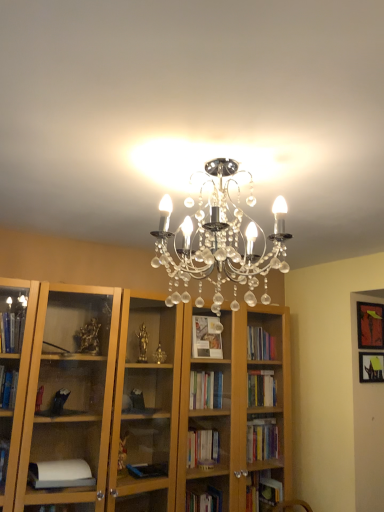
At what (x,y) coordinates should I click in order to perform the action: click on matte black picture frame at upper right, placed as the first picture frame when sorted from top to bottom. Please return your answer as a coordinate pair (x, y). Looking at the image, I should click on (370, 325).

This screenshot has width=384, height=512. What do you see at coordinates (370, 325) in the screenshot?
I see `matte black picture frame at upper right, placed as the 2th picture frame when sorted from bottom to top` at bounding box center [370, 325].

How much space does matte black picture frame at upper right, placed as the first picture frame when sorted from top to bottom, occupy vertically?

matte black picture frame at upper right, placed as the first picture frame when sorted from top to bottom, is 12.43 inches in height.

At what (x,y) coordinates should I click in order to perform the action: click on matte black picture frame at upper right, positioned as the 1th picture frame in bottom-to-top order. Please return your answer as a coordinate pair (x, y). This screenshot has width=384, height=512. Looking at the image, I should click on (371, 367).

This screenshot has width=384, height=512. Describe the element at coordinates (371, 367) in the screenshot. I see `matte black picture frame at upper right, the 2th picture frame from the top` at that location.

In order to face matte black picture frame at upper right, the 2th picture frame from the top, should I rotate leftwards or rightwards?

A 22.996 degree turn to the right will do.

Locate an element on the screen. This screenshot has height=512, width=384. matte black picture frame at upper right, placed as the 2th picture frame when sorted from bottom to top is located at coordinates (370, 325).

Which object is positioned more to the left, matte black picture frame at upper right, placed as the 2th picture frame when sorted from bottom to top, or matte black picture frame at upper right, positioned as the 1th picture frame in bottom-to-top order?

Positioned to the left is matte black picture frame at upper right, positioned as the 1th picture frame in bottom-to-top order.

Which object is further away from the camera taking this photo, matte black picture frame at upper right, placed as the first picture frame when sorted from top to bottom, or matte black picture frame at upper right, positioned as the 1th picture frame in bottom-to-top order?

matte black picture frame at upper right, placed as the first picture frame when sorted from top to bottom, is further from the camera.

Is point (364, 310) closer to camera compared to point (379, 364)?

No, it is behind (379, 364).

From the image's perspective, is matte black picture frame at upper right, placed as the 2th picture frame when sorted from bottom to top, on matte black picture frame at upper right, the 2th picture frame from the top?

Indeed, from the image's perspective, matte black picture frame at upper right, placed as the 2th picture frame when sorted from bottom to top, is shown above matte black picture frame at upper right, the 2th picture frame from the top.

Based on the photo, from a real-world perspective, is matte black picture frame at upper right, placed as the 2th picture frame when sorted from bottom to top, on top of matte black picture frame at upper right, positioned as the 1th picture frame in bottom-to-top order?

Indeed, from a real-world perspective, matte black picture frame at upper right, placed as the 2th picture frame when sorted from bottom to top, stands above matte black picture frame at upper right, positioned as the 1th picture frame in bottom-to-top order.

Looking at their sizes, would you say matte black picture frame at upper right, placed as the 2th picture frame when sorted from bottom to top, is wider or thinner than matte black picture frame at upper right, positioned as the 1th picture frame in bottom-to-top order?

In the image, matte black picture frame at upper right, placed as the 2th picture frame when sorted from bottom to top, appears to be wider than matte black picture frame at upper right, positioned as the 1th picture frame in bottom-to-top order.

Can you confirm if matte black picture frame at upper right, placed as the first picture frame when sorted from top to bottom, is taller than matte black picture frame at upper right, positioned as the 1th picture frame in bottom-to-top order?

Correct, matte black picture frame at upper right, placed as the first picture frame when sorted from top to bottom, is much taller as matte black picture frame at upper right, positioned as the 1th picture frame in bottom-to-top order.

Can you confirm if matte black picture frame at upper right, placed as the 2th picture frame when sorted from bottom to top, is bigger than matte black picture frame at upper right, the 2th picture frame from the top?

Correct, matte black picture frame at upper right, placed as the 2th picture frame when sorted from bottom to top, is larger in size than matte black picture frame at upper right, the 2th picture frame from the top.

Which is correct: matte black picture frame at upper right, placed as the first picture frame when sorted from top to bottom, is inside matte black picture frame at upper right, the 2th picture frame from the top, or outside of it?

matte black picture frame at upper right, placed as the first picture frame when sorted from top to bottom, is outside matte black picture frame at upper right, the 2th picture frame from the top.

Is matte black picture frame at upper right, placed as the first picture frame when sorted from top to bottom, far from matte black picture frame at upper right, positioned as the 1th picture frame in bottom-to-top order?

That's not correct — matte black picture frame at upper right, placed as the first picture frame when sorted from top to bottom, is a little close to matte black picture frame at upper right, positioned as the 1th picture frame in bottom-to-top order.

Is matte black picture frame at upper right, placed as the first picture frame when sorted from top to bottom, oriented away from matte black picture frame at upper right, the 2th picture frame from the top?

No, matte black picture frame at upper right, placed as the first picture frame when sorted from top to bottom,'s orientation is not away from matte black picture frame at upper right, the 2th picture frame from the top.

What's the angular difference between matte black picture frame at upper right, placed as the first picture frame when sorted from top to bottom, and matte black picture frame at upper right, the 2th picture frame from the top,'s facing directions?

matte black picture frame at upper right, placed as the first picture frame when sorted from top to bottom, and matte black picture frame at upper right, the 2th picture frame from the top, are facing 0.0371 degrees away from each other.

Could you measure the distance between matte black picture frame at upper right, placed as the 2th picture frame when sorted from bottom to top, and matte black picture frame at upper right, positioned as the 1th picture frame in bottom-to-top order?

matte black picture frame at upper right, placed as the 2th picture frame when sorted from bottom to top, is 6.09 inches from matte black picture frame at upper right, positioned as the 1th picture frame in bottom-to-top order.

In the image, there is a matte black picture frame at upper right, placed as the 2th picture frame when sorted from bottom to top. Where is `picture frame below it (from the image's perspective)`? The image size is (384, 512). picture frame below it (from the image's perspective) is located at coordinates (371, 367).

Which object is positioned more to the right, matte black picture frame at upper right, the 2th picture frame from the top, or matte black picture frame at upper right, placed as the 2th picture frame when sorted from bottom to top?

Positioned to the right is matte black picture frame at upper right, placed as the 2th picture frame when sorted from bottom to top.

Which is behind, matte black picture frame at upper right, positioned as the 1th picture frame in bottom-to-top order, or matte black picture frame at upper right, placed as the 2th picture frame when sorted from bottom to top?

matte black picture frame at upper right, placed as the 2th picture frame when sorted from bottom to top, is further away from the camera.

Does point (382, 379) come in front of point (378, 332)?

Yes.

From the image's perspective, which is above, matte black picture frame at upper right, positioned as the 1th picture frame in bottom-to-top order, or matte black picture frame at upper right, placed as the 2th picture frame when sorted from bottom to top?

matte black picture frame at upper right, placed as the 2th picture frame when sorted from bottom to top, from the image's perspective.

From a real-world perspective, is matte black picture frame at upper right, positioned as the 1th picture frame in bottom-to-top order, located higher than matte black picture frame at upper right, placed as the 2th picture frame when sorted from bottom to top?

Incorrect, from a real-world perspective, matte black picture frame at upper right, positioned as the 1th picture frame in bottom-to-top order, is lower than matte black picture frame at upper right, placed as the 2th picture frame when sorted from bottom to top.

Consider the image. Which object is thinner, matte black picture frame at upper right, the 2th picture frame from the top, or matte black picture frame at upper right, placed as the 2th picture frame when sorted from bottom to top?

Thinner between the two is matte black picture frame at upper right, the 2th picture frame from the top.

Which of these two, matte black picture frame at upper right, the 2th picture frame from the top, or matte black picture frame at upper right, placed as the first picture frame when sorted from top to bottom, stands taller?

With more height is matte black picture frame at upper right, placed as the first picture frame when sorted from top to bottom.

Considering the sizes of objects matte black picture frame at upper right, the 2th picture frame from the top, and matte black picture frame at upper right, placed as the first picture frame when sorted from top to bottom, in the image provided, who is bigger, matte black picture frame at upper right, the 2th picture frame from the top, or matte black picture frame at upper right, placed as the first picture frame when sorted from top to bottom,?

Bigger between the two is matte black picture frame at upper right, placed as the first picture frame when sorted from top to bottom.

Do you think matte black picture frame at upper right, positioned as the 1th picture frame in bottom-to-top order, is within matte black picture frame at upper right, placed as the first picture frame when sorted from top to bottom, or outside of it?

The correct answer is: outside.

Can you see matte black picture frame at upper right, the 2th picture frame from the top, touching matte black picture frame at upper right, placed as the 2th picture frame when sorted from bottom to top?

They are not placed beside each other.

Is matte black picture frame at upper right, positioned as the 1th picture frame in bottom-to-top order, turned away from matte black picture frame at upper right, placed as the first picture frame when sorted from top to bottom?

matte black picture frame at upper right, positioned as the 1th picture frame in bottom-to-top order, is not turned away from matte black picture frame at upper right, placed as the first picture frame when sorted from top to bottom.

Can you tell me how much matte black picture frame at upper right, positioned as the 1th picture frame in bottom-to-top order, and matte black picture frame at upper right, placed as the 2th picture frame when sorted from bottom to top, differ in facing direction?

0.0371 degrees.

You are a GUI agent. You are given a task and a screenshot of the screen. Output one action in this format:
    pyautogui.click(x=<x>, y=<y>)
    Task: Click on the picture frame that appears below the matte black picture frame at upper right, placed as the first picture frame when sorted from top to bottom (from a real-world perspective)
    This screenshot has width=384, height=512.
    Given the screenshot: What is the action you would take?
    pyautogui.click(x=371, y=367)

This screenshot has width=384, height=512. What are the coordinates of `picture frame that appears below the matte black picture frame at upper right, placed as the 2th picture frame when sorted from bottom to top (from a real-world perspective)` in the screenshot? It's located at (371, 367).

Image resolution: width=384 pixels, height=512 pixels. In order to click on picture frame above the matte black picture frame at upper right, the 2th picture frame from the top (from the image's perspective) in this screenshot , I will do `click(370, 325)`.